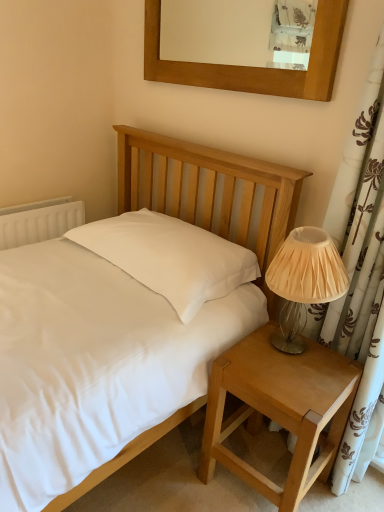
Where is `free space in front of ivory pleated fabric lampshade at right`? Image resolution: width=384 pixels, height=512 pixels. free space in front of ivory pleated fabric lampshade at right is located at coordinates (299, 383).